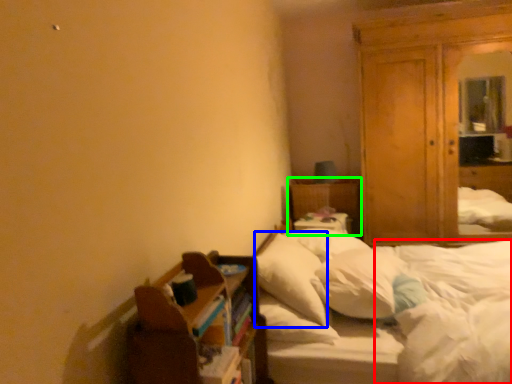
Question: Estimate the real-world distances between objects in this image. Which object is closer to mattress (highlighted by a red box), pillow (highlighted by a blue box) or bed frame (highlighted by a green box)?

Choices:
 (A) pillow
 (B) bed frame

Answer: (A)